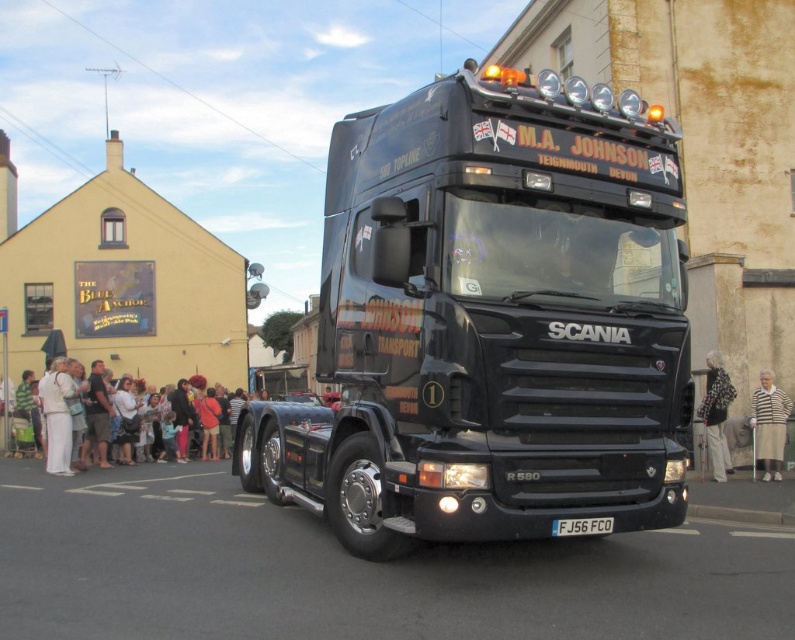
Question: Which object is closer to the camera taking this photo?

Choices:
 (A) white cotton dress at lower left
 (B) black metal license plate at center

Answer: (B)

Question: Where is black matte truck at center located in relation to black metal license plate at center in the image?

Choices:
 (A) below
 (B) above

Answer: (B)

Question: Which object is positioned closest to the white cotton dress at lower left?

Choices:
 (A) black metal license plate at center
 (B) white fabric dress at left
 (C) patterned fabric coat at right
 (D) black matte truck at center

Answer: (B)

Question: Which point is farther from the camera taking this photo?

Choices:
 (A) (56, 397)
 (B) (761, 428)
 (C) (84, 401)
 (D) (708, 444)

Answer: (C)

Question: Can you confirm if black matte truck at center is positioned to the right of black metal license plate at center?

Choices:
 (A) yes
 (B) no

Answer: (B)

Question: In this image, where is white cotton dress at lower left located relative to white fabric dress at left?

Choices:
 (A) above
 (B) below

Answer: (A)